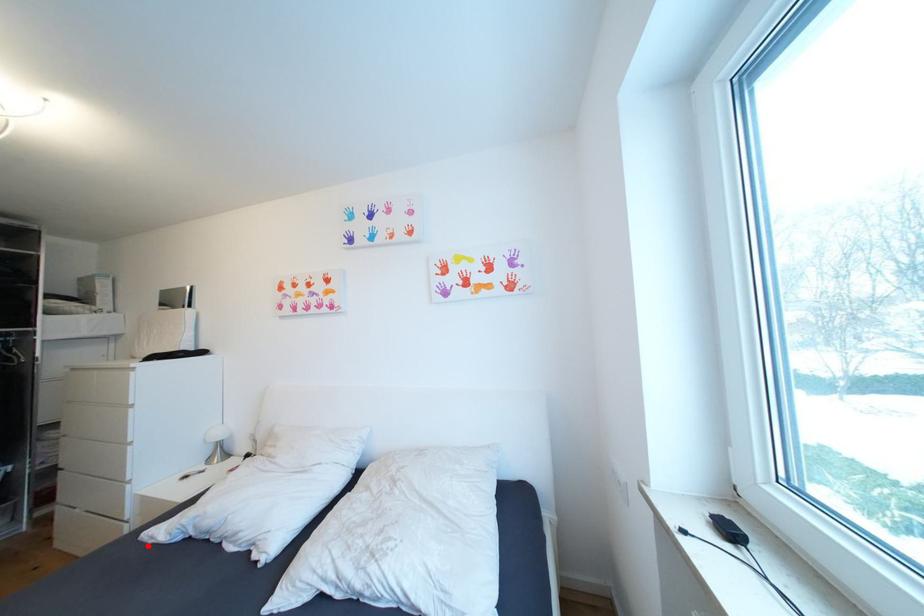
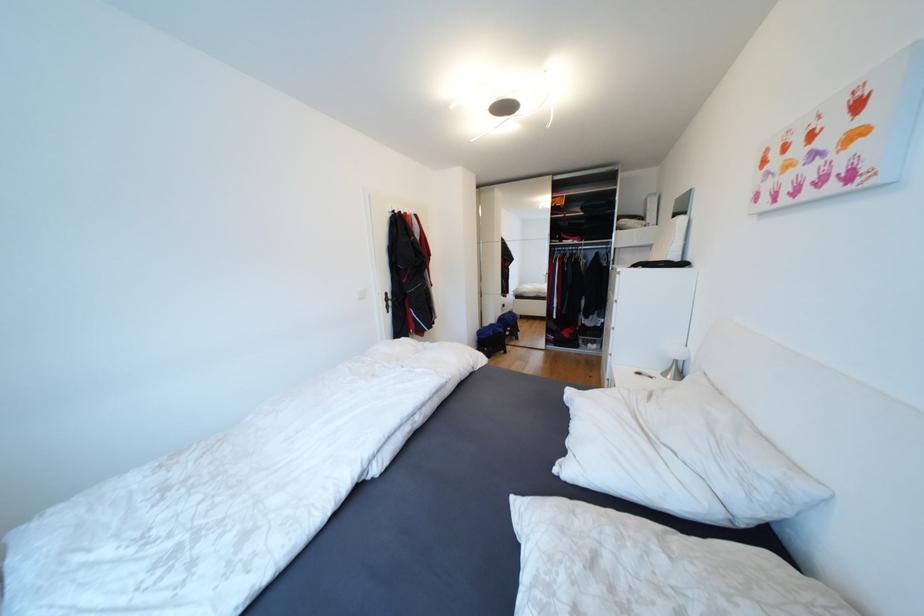
Locate, in the second image, the point that corresponds to the highlighted location in the first image.

(570, 394)